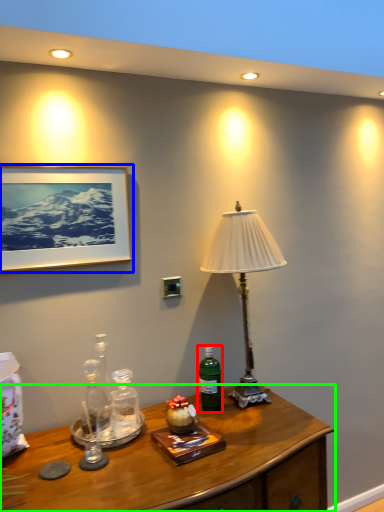
Question: Which object is positioned closest to bottle (highlighted by a red box)? Select from picture frame (highlighted by a blue box) and desk (highlighted by a green box).

Choices:
 (A) picture frame
 (B) desk

Answer: (B)